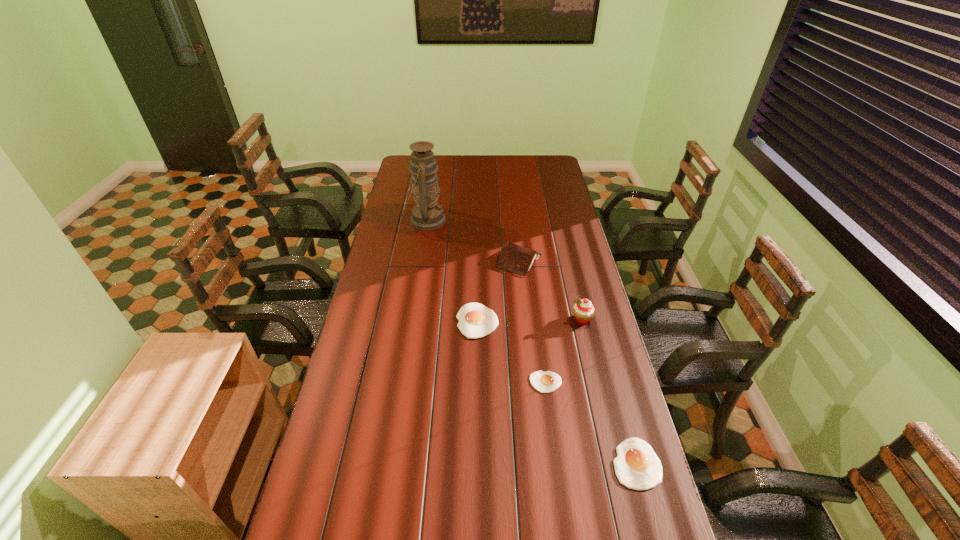
Identify the location of object at the near right corner. This screenshot has height=540, width=960. (637, 466).

Locate an element on the screen. free space at the far edge is located at coordinates (x=446, y=158).

Locate an element on the screen. free space at the near edge of the desktop is located at coordinates coord(481,490).

This screenshot has height=540, width=960. I want to click on vacant point at the left edge, so click(x=371, y=289).

The image size is (960, 540). What are the coordinates of `free space at the right edge` in the screenshot? It's located at coord(624,406).

You are a GUI agent. You are given a task and a screenshot of the screen. Output one action in this format:
    pyautogui.click(x=<x>, y=<y>)
    Task: Click on the free space between the nearest object and the third tallest object
    The height and width of the screenshot is (540, 960).
    Given the screenshot: What is the action you would take?
    pyautogui.click(x=578, y=362)

At what (x,y) coordinates should I click in order to perform the action: click on free area in between the farthest egg yolk and the fifth nearest object. Please return your answer as a coordinate pair (x, y). Looking at the image, I should click on (498, 291).

The width and height of the screenshot is (960, 540). I want to click on free area in between the shortest object and the cupcake, so click(x=564, y=350).

Image resolution: width=960 pixels, height=540 pixels. I want to click on vacant space that is in between the fifth nearest object and the farthest egg yolk, so click(x=498, y=291).

Where is `blank region between the second egg yolk from left to right and the fifth shortest object`? The image size is (960, 540). blank region between the second egg yolk from left to right and the fifth shortest object is located at coordinates point(564,350).